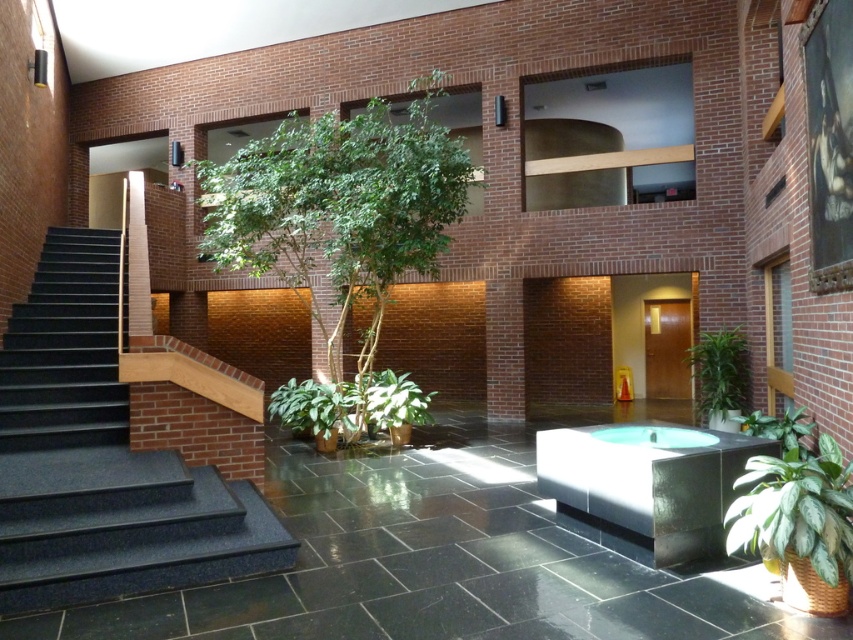
Question: Does granite steps at left appear under green glossy leafy plant at center?

Choices:
 (A) no
 (B) yes

Answer: (B)

Question: Does green glossy plant at right have a lesser width compared to green glossy leafy plant at center?

Choices:
 (A) no
 (B) yes

Answer: (B)

Question: Which point is closer to the camera?

Choices:
 (A) green leafy tree at center
 (B) granite steps at left
 (C) green glossy leafy plant at lower right

Answer: (C)

Question: Does granite steps at left lie in front of green glossy leafy plant at center?

Choices:
 (A) no
 (B) yes

Answer: (B)

Question: Among these objects, which one is nearest to the camera?

Choices:
 (A) polished stainless steel jacuzzi at center
 (B) green glossy leafy plant at lower right
 (C) granite steps at left
 (D) green glossy plant at center

Answer: (B)

Question: Which point appears farthest from the camera in this image?

Choices:
 (A) (703, 387)
 (B) (447, 236)

Answer: (B)